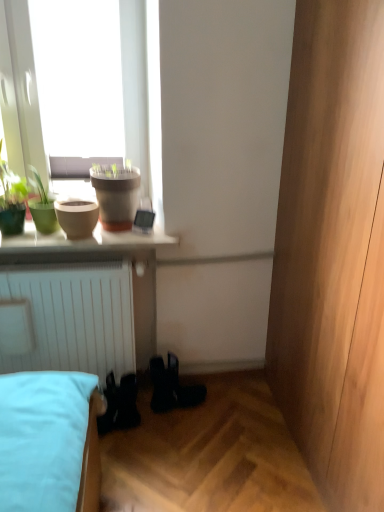
What do you see at coordinates (116, 197) in the screenshot?
I see `matte clay pot at upper left, which is counted as the 2th flowerpot, starting from the left` at bounding box center [116, 197].

At what (x,y) coordinates should I click in order to perform the action: click on green matte pot at upper left, marked as the first houseplant in a right-to-left arrangement. Please return your answer as a coordinate pair (x, y). The width and height of the screenshot is (384, 512). Looking at the image, I should click on (42, 206).

At what (x,y) coordinates should I click in order to perform the action: click on matte beige flowerpot at left, the second flowerpot viewed from the right. Please return your answer as a coordinate pair (x, y). Looking at the image, I should click on (77, 217).

Consider the image. What is the approximate height of black rubber boots at lower center?

The height of black rubber boots at lower center is 26.60 centimeters.

Where is `green matte plant at upper left, the 1th houseplant in the left-to-right sequence`? The height and width of the screenshot is (512, 384). green matte plant at upper left, the 1th houseplant in the left-to-right sequence is located at coordinates (12, 199).

Considering the positions of objects green matte pot at upper left, the second houseplant in the left-to-right sequence, and black rubber boots at lower center in the image provided, who is behind, green matte pot at upper left, the second houseplant in the left-to-right sequence, or black rubber boots at lower center?

black rubber boots at lower center is more distant.

Considering the sizes of objects green matte pot at upper left, marked as the first houseplant in a right-to-left arrangement, and black rubber boots at lower center in the image provided, who is smaller, green matte pot at upper left, marked as the first houseplant in a right-to-left arrangement, or black rubber boots at lower center?

Smaller between the two is green matte pot at upper left, marked as the first houseplant in a right-to-left arrangement.

Is green matte pot at upper left, the second houseplant in the left-to-right sequence, with black rubber boots at lower center?

No.

Does point (43, 226) come behind point (165, 394)?

No, (43, 226) is closer to viewer.

Identify the location of houseplant below the matte clay pot at upper left, arranged as the 1th flowerpot when viewed from the right (from a real-world perspective). This screenshot has width=384, height=512. (42, 206).

Which is in front, point (124, 221) or point (50, 219)?

The point (50, 219) is closer to the camera.

Looking at their sizes, would you say matte clay pot at upper left, which is counted as the 2th flowerpot, starting from the left, is wider or thinner than green matte pot at upper left, the second houseplant in the left-to-right sequence?

Clearly, matte clay pot at upper left, which is counted as the 2th flowerpot, starting from the left, has more width compared to green matte pot at upper left, the second houseplant in the left-to-right sequence.

Is matte clay pot at upper left, arranged as the 1th flowerpot when viewed from the right, looking in the opposite direction of green matte pot at upper left, the second houseplant in the left-to-right sequence?

No, green matte pot at upper left, the second houseplant in the left-to-right sequence, is not at the back of matte clay pot at upper left, arranged as the 1th flowerpot when viewed from the right.

How much distance is there between green matte pot at upper left, marked as the first houseplant in a right-to-left arrangement, and white glossy shelf at upper center?

6.50 inches.

Who is shorter, green matte pot at upper left, the second houseplant in the left-to-right sequence, or white glossy shelf at upper center?

Standing shorter between the two is white glossy shelf at upper center.

Is green matte pot at upper left, the second houseplant in the left-to-right sequence, positioned beyond the bounds of white glossy shelf at upper center?

Yes, green matte pot at upper left, the second houseplant in the left-to-right sequence, is not within white glossy shelf at upper center.

What are the coordinates of `houseplant that is the 1st object located above the white glossy shelf at upper center (from the image's perspective)` in the screenshot? It's located at (42, 206).

Is green matte plant at upper left, the 1th houseplant in the left-to-right sequence, thinner than matte clay pot at upper left, which is counted as the 2th flowerpot, starting from the left?

Indeed, green matte plant at upper left, the 1th houseplant in the left-to-right sequence, has a lesser width compared to matte clay pot at upper left, which is counted as the 2th flowerpot, starting from the left.

What's the angular difference between green matte plant at upper left, the second houseplant when ordered from right to left, and matte clay pot at upper left, arranged as the 1th flowerpot when viewed from the right,'s facing directions?

0.00132 degrees separate the facing orientations of green matte plant at upper left, the second houseplant when ordered from right to left, and matte clay pot at upper left, arranged as the 1th flowerpot when viewed from the right.

From the image's perspective, is green matte plant at upper left, the second houseplant when ordered from right to left, on matte clay pot at upper left, which is counted as the 2th flowerpot, starting from the left?

Yes, from the image's perspective, green matte plant at upper left, the second houseplant when ordered from right to left, is on top of matte clay pot at upper left, which is counted as the 2th flowerpot, starting from the left.

Which is correct: green matte plant at upper left, the second houseplant when ordered from right to left, is inside matte clay pot at upper left, which is counted as the 2th flowerpot, starting from the left, or outside of it?

green matte plant at upper left, the second houseplant when ordered from right to left, is not enclosed by matte clay pot at upper left, which is counted as the 2th flowerpot, starting from the left.

Which of these two, matte clay pot at upper left, which is counted as the 2th flowerpot, starting from the left, or white glossy shelf at upper center, is thinner?

matte clay pot at upper left, which is counted as the 2th flowerpot, starting from the left, is thinner.

What are the coordinates of `counter top that appears on the left of matte clay pot at upper left, which is counted as the 2th flowerpot, starting from the left` in the screenshot? It's located at (82, 241).

Is point (119, 185) farther from viewer compared to point (11, 239)?

Yes, it is.

Consider the image. How much distance is there between matte beige flowerpot at left, the 1th flowerpot viewed from the left, and white glossy shelf at upper center?

matte beige flowerpot at left, the 1th flowerpot viewed from the left, and white glossy shelf at upper center are 12.14 centimeters apart.

How many degrees apart are the facing directions of matte beige flowerpot at left, the second flowerpot viewed from the right, and white glossy shelf at upper center?

0.00307 degrees separate the facing orientations of matte beige flowerpot at left, the second flowerpot viewed from the right, and white glossy shelf at upper center.

Does matte beige flowerpot at left, the second flowerpot viewed from the right, appear on the left side of white glossy shelf at upper center?

Correct, you'll find matte beige flowerpot at left, the second flowerpot viewed from the right, to the left of white glossy shelf at upper center.

Would you say matte beige flowerpot at left, the second flowerpot viewed from the right, is inside or outside white glossy shelf at upper center?

matte beige flowerpot at left, the second flowerpot viewed from the right, is not enclosed by white glossy shelf at upper center.

Considering the points (41, 253) and (95, 185), which point is behind, point (41, 253) or point (95, 185)?

The point (95, 185) is farther from the camera.

From a real-world perspective, is white glossy shelf at upper center above or below matte clay pot at upper left, which is counted as the 2th flowerpot, starting from the left?

white glossy shelf at upper center is below matte clay pot at upper left, which is counted as the 2th flowerpot, starting from the left.

Is matte clay pot at upper left, arranged as the 1th flowerpot when viewed from the right, surrounded by white glossy shelf at upper center?

Definitely not — matte clay pot at upper left, arranged as the 1th flowerpot when viewed from the right, is not inside white glossy shelf at upper center.

Which is more to the left, white glossy shelf at upper center or matte clay pot at upper left, which is counted as the 2th flowerpot, starting from the left?

From the viewer's perspective, white glossy shelf at upper center appears more on the left side.

Image resolution: width=384 pixels, height=512 pixels. What are the coordinates of `shoe that appears behind the green matte pot at upper left, marked as the first houseplant in a right-to-left arrangement` in the screenshot? It's located at (172, 387).

The height and width of the screenshot is (512, 384). I want to click on flowerpot that appears above the green matte pot at upper left, the second houseplant in the left-to-right sequence (from a real-world perspective), so click(116, 197).

From the image, which object appears to be farther from matte beige flowerpot at left, the 1th flowerpot viewed from the left, black rubber boots at lower center or matte clay pot at upper left, which is counted as the 2th flowerpot, starting from the left?

The object further to matte beige flowerpot at left, the 1th flowerpot viewed from the left, is black rubber boots at lower center.

When comparing their distances from green matte plant at upper left, the second houseplant when ordered from right to left, does green matte pot at upper left, the second houseplant in the left-to-right sequence, or white glossy shelf at upper center seem closer?

green matte pot at upper left, the second houseplant in the left-to-right sequence, is positioned closer to the anchor green matte plant at upper left, the second houseplant when ordered from right to left.

When comparing their distances from matte beige flowerpot at left, the 1th flowerpot viewed from the left, does white glossy shelf at upper center or green matte pot at upper left, marked as the first houseplant in a right-to-left arrangement, seem further?

Among the two, green matte pot at upper left, marked as the first houseplant in a right-to-left arrangement, is located further to matte beige flowerpot at left, the 1th flowerpot viewed from the left.

When comparing their distances from white glossy shelf at upper center, does matte beige flowerpot at left, the second flowerpot viewed from the right, or green matte pot at upper left, the second houseplant in the left-to-right sequence, seem closer?

Among the two, matte beige flowerpot at left, the second flowerpot viewed from the right, is located nearer to white glossy shelf at upper center.

Looking at the image, which one is located further to white glossy shelf at upper center, matte clay pot at upper left, which is counted as the 2th flowerpot, starting from the left, or matte beige flowerpot at left, the second flowerpot viewed from the right?

matte clay pot at upper left, which is counted as the 2th flowerpot, starting from the left, lies further to white glossy shelf at upper center than the other object.

Consider the image. Which object lies further to the anchor point green matte pot at upper left, the second houseplant in the left-to-right sequence, matte clay pot at upper left, arranged as the 1th flowerpot when viewed from the right, or white glossy shelf at upper center?

Based on the image, matte clay pot at upper left, arranged as the 1th flowerpot when viewed from the right, appears to be further to green matte pot at upper left, the second houseplant in the left-to-right sequence.

Considering their positions, is matte beige flowerpot at left, the 1th flowerpot viewed from the left, positioned further to white glossy shelf at upper center than green matte plant at upper left, the 1th houseplant in the left-to-right sequence?

The object further to white glossy shelf at upper center is green matte plant at upper left, the 1th houseplant in the left-to-right sequence.

From the picture: Looking at the image, which one is located closer to matte clay pot at upper left, arranged as the 1th flowerpot when viewed from the right, green matte pot at upper left, the second houseplant in the left-to-right sequence, or white glossy shelf at upper center?

white glossy shelf at upper center is closer to matte clay pot at upper left, arranged as the 1th flowerpot when viewed from the right.

Find the location of a particular element. This screenshot has height=512, width=384. flowerpot located between green matte pot at upper left, the second houseplant in the left-to-right sequence, and white glossy shelf at upper center in the left-right direction is located at coordinates (77, 217).

Identify the location of houseplant between green matte plant at upper left, the 1th houseplant in the left-to-right sequence, and matte beige flowerpot at left, the 1th flowerpot viewed from the left, from left to right. The width and height of the screenshot is (384, 512). (42, 206).

Locate an element on the screen. This screenshot has height=512, width=384. counter top between green matte plant at upper left, the second houseplant when ordered from right to left, and matte clay pot at upper left, arranged as the 1th flowerpot when viewed from the right, in the horizontal direction is located at coordinates (82, 241).

Where is `counter top between matte beige flowerpot at left, the second flowerpot viewed from the right, and black rubber boots at lower center vertically`? This screenshot has width=384, height=512. counter top between matte beige flowerpot at left, the second flowerpot viewed from the right, and black rubber boots at lower center vertically is located at coordinates (82, 241).